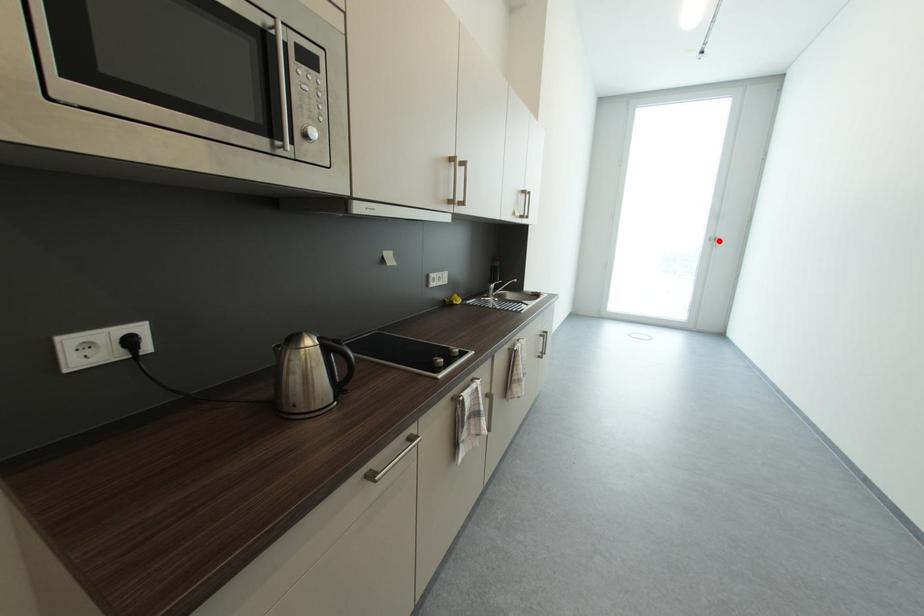
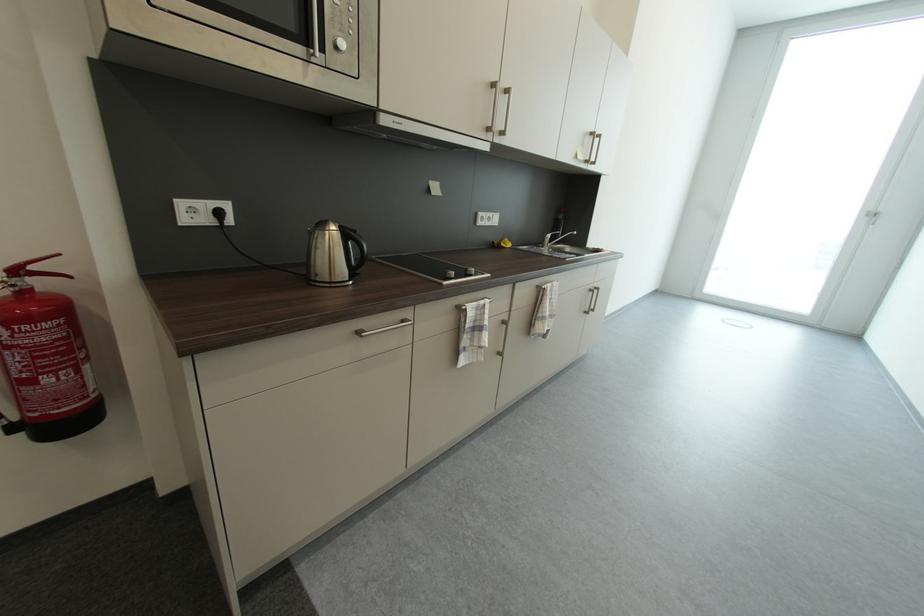
Question: A red point is marked in image1. In image2, is the corresponding 3D point closer to the camera or farther? Reply with the corresponding letter.

Choices:
 (A) The corresponding 3D point is closer.
 (B) The corresponding 3D point is farther.

Answer: (B)